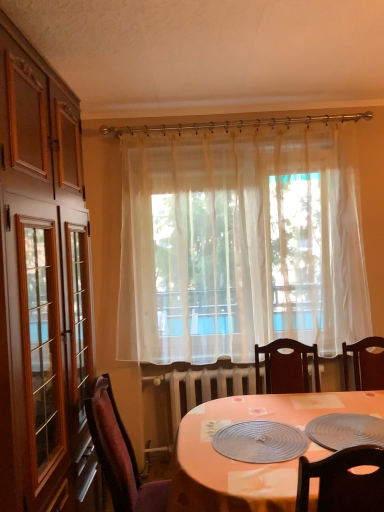
Locate an element on the screen. Image resolution: width=384 pixels, height=512 pixels. vacant space behind metallic textured platter at center, which is the 2th platter from right to left is located at coordinates (251, 410).